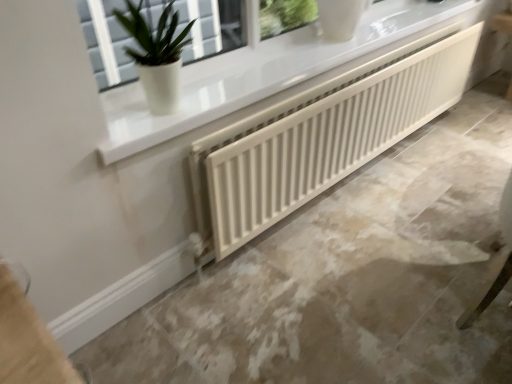
Question: Does white matte radiator at center have a smaller size compared to white ribbed radiator at center?

Choices:
 (A) no
 (B) yes

Answer: (A)

Question: Is white ribbed radiator at center completely or partially inside white matte radiator at center?

Choices:
 (A) no
 (B) yes

Answer: (A)

Question: From the image's perspective, is white matte radiator at center beneath white ribbed radiator at center?

Choices:
 (A) no
 (B) yes

Answer: (B)

Question: Is white matte radiator at center touching white ribbed radiator at center?

Choices:
 (A) no
 (B) yes

Answer: (A)

Question: Would you say white matte radiator at center is outside white ribbed radiator at center?

Choices:
 (A) no
 (B) yes

Answer: (B)

Question: Considering the positions of white ribbed radiator at center and white matte radiator at center in the image, is white ribbed radiator at center bigger or smaller than white matte radiator at center?

Choices:
 (A) small
 (B) big

Answer: (A)

Question: Would you say white ribbed radiator at center is inside or outside white matte radiator at center?

Choices:
 (A) inside
 (B) outside

Answer: (B)

Question: From the image's perspective, is white ribbed radiator at center located above or below white matte radiator at center?

Choices:
 (A) above
 (B) below

Answer: (A)

Question: In the image, is white ribbed radiator at center on the left side or the right side of white matte radiator at center?

Choices:
 (A) left
 (B) right

Answer: (A)

Question: Considering the positions of white matte radiator at center and green matte plant at upper left in the image, is white matte radiator at center taller or shorter than green matte plant at upper left?

Choices:
 (A) short
 (B) tall

Answer: (A)

Question: From a real-world perspective, is white matte radiator at center above or below green matte plant at upper left?

Choices:
 (A) below
 (B) above

Answer: (A)

Question: In terms of size, does white matte radiator at center appear bigger or smaller than green matte plant at upper left?

Choices:
 (A) big
 (B) small

Answer: (A)

Question: Is white matte radiator at center wider or thinner than green matte plant at upper left?

Choices:
 (A) thin
 (B) wide

Answer: (B)

Question: Looking at the image, does green matte plant at upper left seem bigger or smaller compared to white ribbed radiator at center?

Choices:
 (A) big
 (B) small

Answer: (B)

Question: Is point (150, 87) closer or farther from the camera than point (357, 140)?

Choices:
 (A) farther
 (B) closer

Answer: (B)